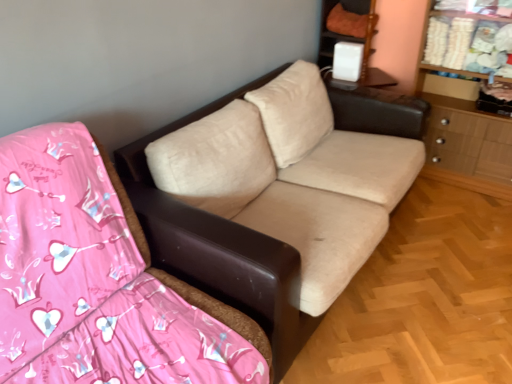
Question: Does white plastic speaker at upper right have a lesser height compared to beige fabric couch at center?

Choices:
 (A) no
 (B) yes

Answer: (A)

Question: From the image's perspective, is white plastic speaker at upper right located above beige fabric couch at center?

Choices:
 (A) no
 (B) yes

Answer: (B)

Question: Is the depth of white plastic speaker at upper right less than that of beige fabric couch at center?

Choices:
 (A) yes
 (B) no

Answer: (B)

Question: Does white plastic speaker at upper right have a greater width compared to beige fabric couch at center?

Choices:
 (A) no
 (B) yes

Answer: (A)

Question: From the image's perspective, is white plastic speaker at upper right located beneath beige fabric couch at center?

Choices:
 (A) yes
 (B) no

Answer: (B)

Question: From the image's perspective, is wooden dresser at right positioned above or below beige fabric couch at center?

Choices:
 (A) below
 (B) above

Answer: (B)

Question: Considering the positions of point (476, 168) and point (379, 100), is point (476, 168) closer or farther from the camera than point (379, 100)?

Choices:
 (A) closer
 (B) farther

Answer: (B)

Question: In the image, is wooden dresser at right on the left side or the right side of beige fabric couch at center?

Choices:
 (A) right
 (B) left

Answer: (A)

Question: Is wooden dresser at right in front of or behind beige fabric couch at center in the image?

Choices:
 (A) behind
 (B) front

Answer: (A)

Question: In terms of width, does beige fabric couch at center look wider or thinner when compared to white plastic speaker at upper right?

Choices:
 (A) wide
 (B) thin

Answer: (A)

Question: Visually, is beige fabric couch at center positioned to the left or to the right of white plastic speaker at upper right?

Choices:
 (A) left
 (B) right

Answer: (A)

Question: From the image's perspective, is beige fabric couch at center positioned above or below white plastic speaker at upper right?

Choices:
 (A) below
 (B) above

Answer: (A)

Question: Is beige fabric couch at center inside the boundaries of white plastic speaker at upper right, or outside?

Choices:
 (A) inside
 (B) outside

Answer: (B)

Question: From the image's perspective, is white plastic speaker at upper right located above or below wooden dresser at right?

Choices:
 (A) above
 (B) below

Answer: (A)

Question: Is white plastic speaker at upper right inside or outside of wooden dresser at right?

Choices:
 (A) inside
 (B) outside

Answer: (B)